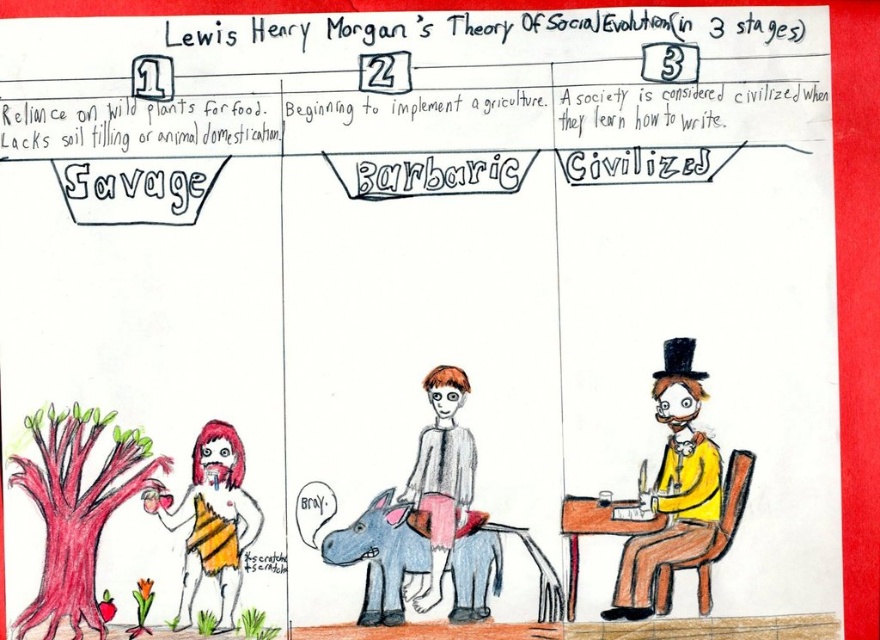
Based on the coordinates provided, which object is located at point (672,488)?

The yellow matte suit at center right is located at point (672,488).

Based on the scene of the Savage stage from Lewis Henry Morgan theory, which object is positioned to the left of the other between the striped fabric figure at lower left and the light brown paper bag at center?

The striped fabric figure at lower left is positioned to the left of the light brown paper bag at center.

What is the position of the striped fabric figure at lower left in the Savage stage?

The striped fabric figure at lower left is located at point (211, 520).